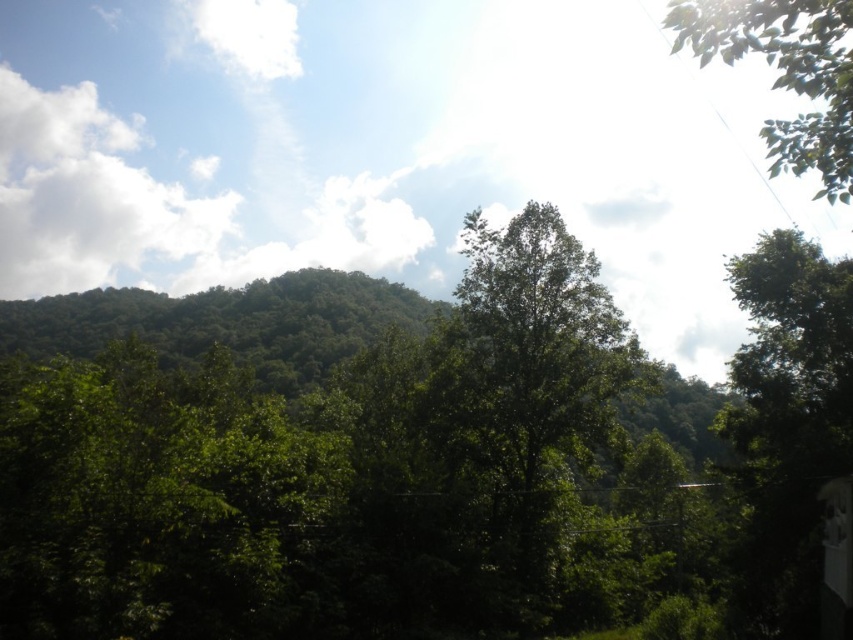
Question: Can you confirm if green leafy tree at center is wider than green leafy tree at upper right?

Choices:
 (A) no
 (B) yes

Answer: (A)

Question: Is green leafy tree at center smaller than green leafy tree at upper right?

Choices:
 (A) no
 (B) yes

Answer: (B)

Question: Is the position of green leafy tree at center less distant than that of green leafy tree at upper right?

Choices:
 (A) yes
 (B) no

Answer: (B)

Question: Among these objects, which one is farthest from the camera?

Choices:
 (A) green leafy tree at upper right
 (B) green leafy tree at center

Answer: (B)

Question: Which point is farther to the camera?

Choices:
 (A) green leafy tree at upper right
 (B) green leafy tree at center

Answer: (B)